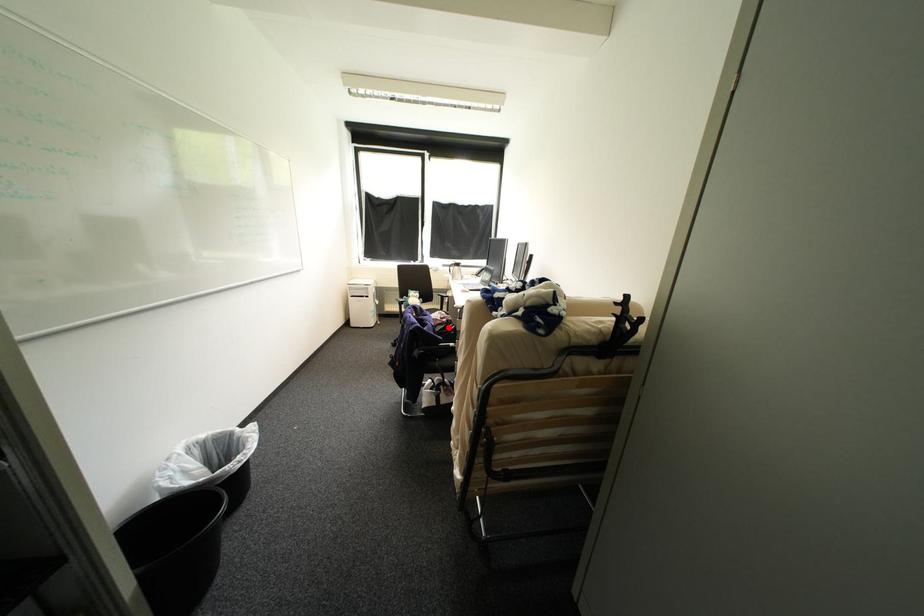
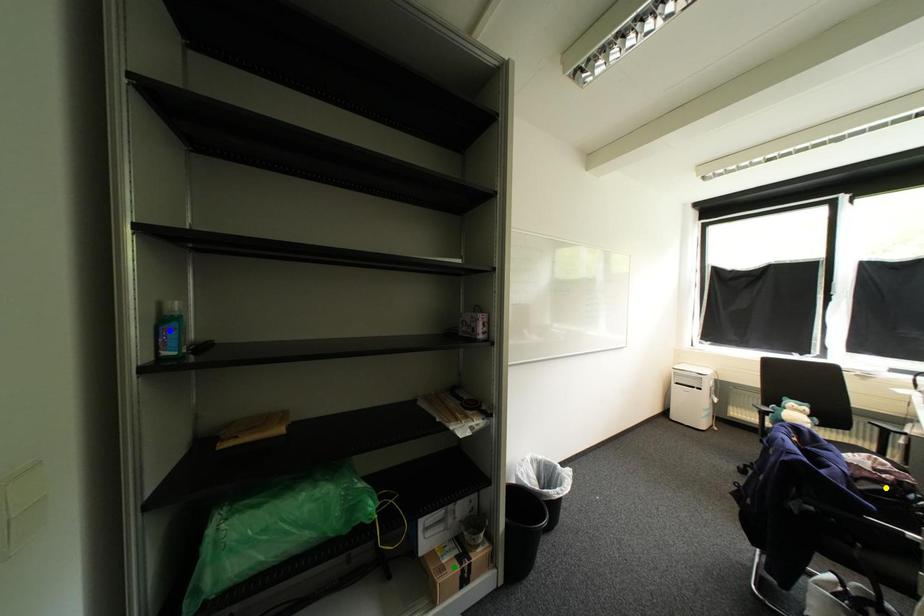
Question: I am providing you with two images of the same scene from different viewpoints. A red point is marked on the first image. You are given multiple points on the second image. In image 2, which mark is for the same physical point as the one in image 1?

Choices:
 (A) green point
 (B) yellow point
 (C) blue point

Answer: (B)